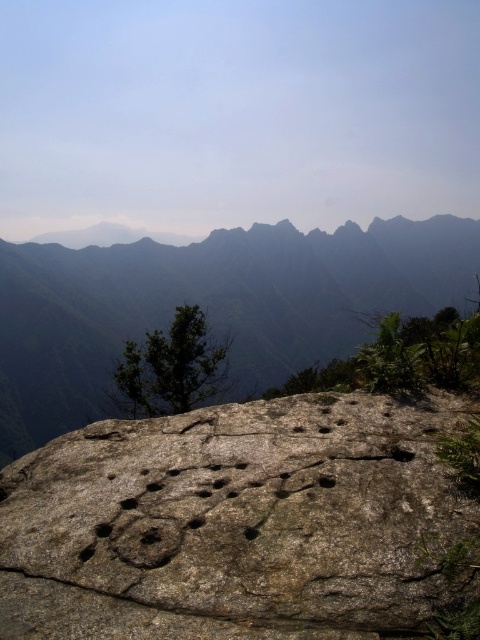
Question: From the image, what is the correct spatial relationship of gray rough boulder at center in relation to gray rough rock at center?

Choices:
 (A) above
 (B) below

Answer: (B)

Question: Can you confirm if gray rough boulder at center is bigger than gray rough rock at center?

Choices:
 (A) no
 (B) yes

Answer: (A)

Question: Which point is closer to the camera taking this photo?

Choices:
 (A) (23, 435)
 (B) (396, 577)

Answer: (B)

Question: Among these points, which one is farthest from the camera?

Choices:
 (A) (41, 408)
 (B) (384, 572)

Answer: (A)

Question: Can you confirm if gray rough boulder at center is bigger than gray rough rock at center?

Choices:
 (A) yes
 (B) no

Answer: (B)